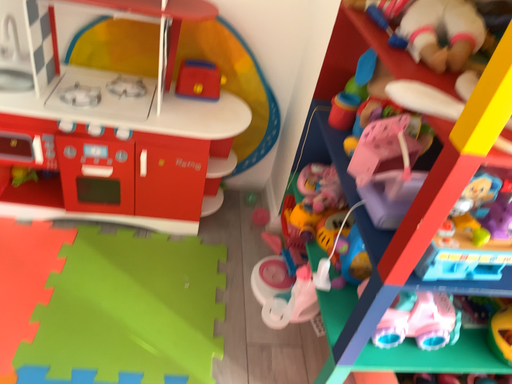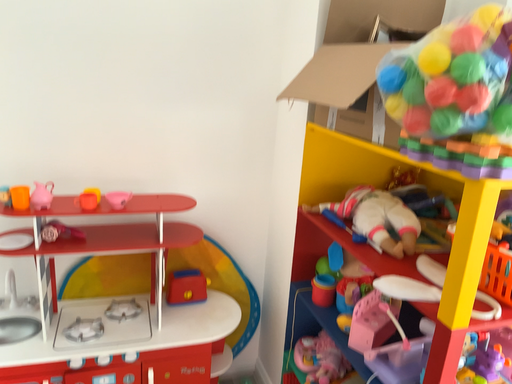
Question: Which way did the camera rotate in the video?

Choices:
 (A) rotated downward
 (B) rotated upward

Answer: (B)